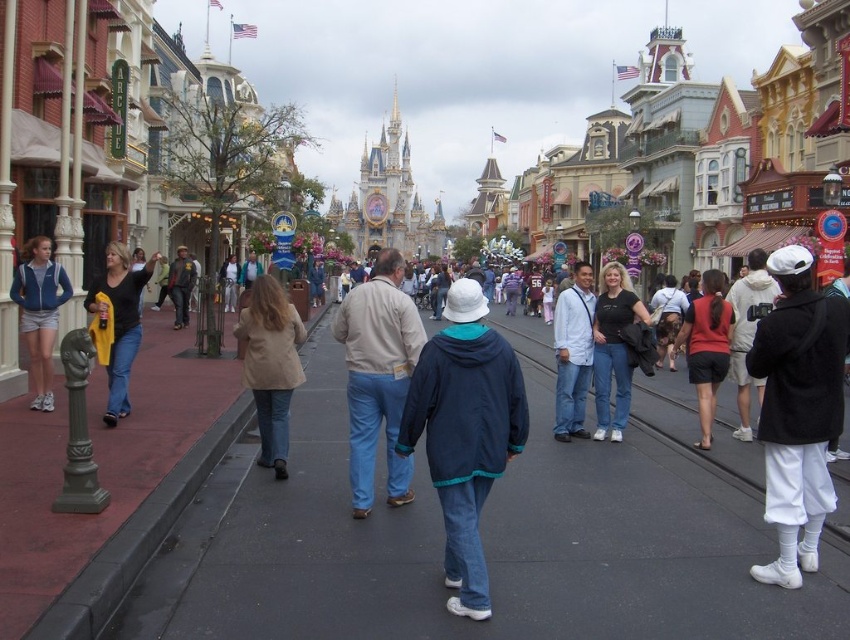
Question: Which object is closer to the camera taking this photo?

Choices:
 (A) matte black jacket at center
 (B) denim jacket at center

Answer: (A)

Question: Does light brown cotton jacket at center have a smaller size compared to white cotton shirt at center?

Choices:
 (A) yes
 (B) no

Answer: (B)

Question: Is matte black jacket at center bigger than denim jacket at center?

Choices:
 (A) yes
 (B) no

Answer: (B)

Question: Considering the relative positions of light brown cotton jacket at center and white matte camera at right in the image provided, where is light brown cotton jacket at center located with respect to white matte camera at right?

Choices:
 (A) above
 (B) below

Answer: (A)

Question: Estimate the real-world distances between objects in this image. Which object is farther from the light brown cotton jacket at center?

Choices:
 (A) black asphalt at center
 (B) matte blue jacket at left
 (C) white cotton shirt at center

Answer: (B)

Question: Considering the real-world distances, which object is farthest from the yellow fabric at left?

Choices:
 (A) light brown cotton jacket at center
 (B) matte black jacket at center

Answer: (B)